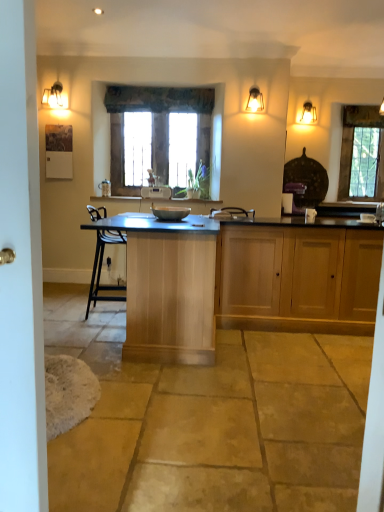
Find the location of a particular element. The height and width of the screenshot is (512, 384). free space in front of wooden cabinet at center, the second cabinetry when ordered from left to right is located at coordinates (310, 357).